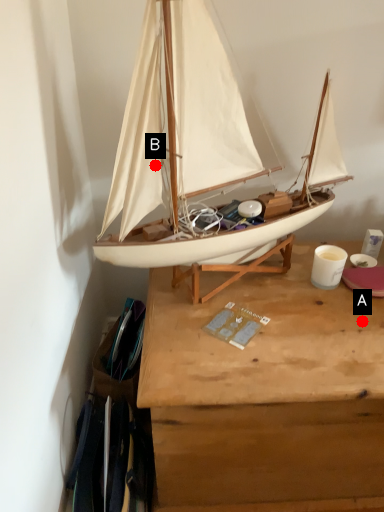
Question: Two points are circled on the image, labeled by A and B beside each circle. Which of the following is the closest to the observer?

Choices:
 (A) A is closer
 (B) B is closer

Answer: (B)